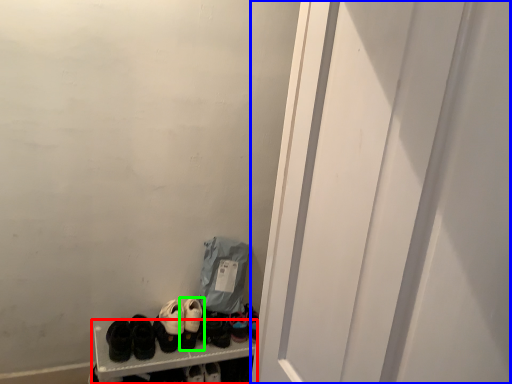
Question: Which object is the farthest from bookshelf (highlighted by a red box)? Choose among these: screen door (highlighted by a blue box) or footwear (highlighted by a green box).

Choices:
 (A) screen door
 (B) footwear

Answer: (A)